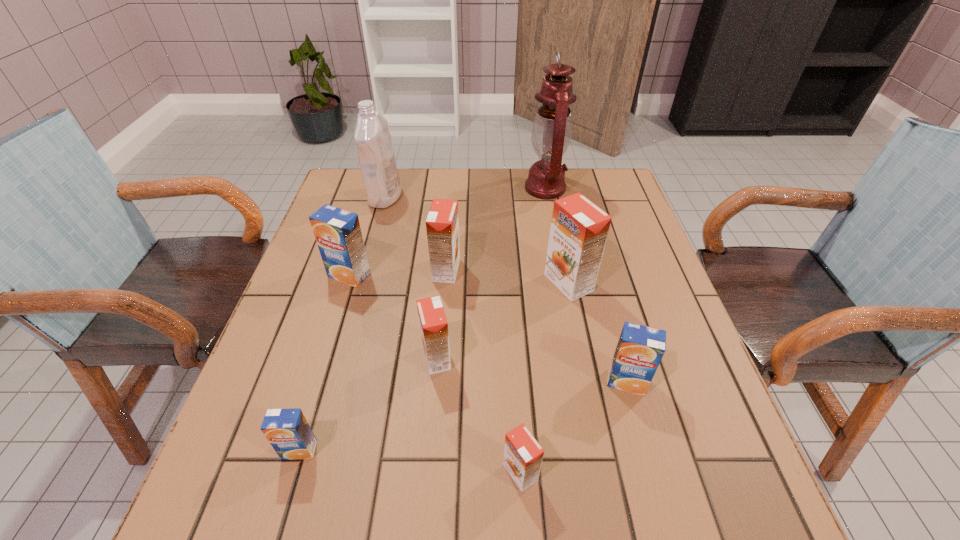
Image resolution: width=960 pixels, height=540 pixels. In order to click on free space located 0.280m on the left of the rightmost blue orange_juice in this screenshot , I will do `click(463, 382)`.

Identify the location of vacant area located 0.070m on the back of the smallest blue orange_juice. (313, 404).

Locate an element on the screen. The width and height of the screenshot is (960, 540). blank space located on the right of the second orange orange juice from right to left is located at coordinates (567, 472).

Find the location of `oil lamp that is at the far edge`. oil lamp that is at the far edge is located at coordinates (552, 128).

Locate an element on the screen. The image size is (960, 540). detergent at the far edge is located at coordinates (375, 151).

You are a GUI agent. You are given a task and a screenshot of the screen. Output one action in this format:
    pyautogui.click(x=<x>, y=<y>)
    Task: Click on the object located at the near edge
    The image size is (960, 540).
    Given the screenshot: What is the action you would take?
    pyautogui.click(x=523, y=455)

At what (x,y) coordinates should I click in order to perform the action: click on detergent at the left edge. Please return your answer as a coordinate pair (x, y). Image resolution: width=960 pixels, height=540 pixels. Looking at the image, I should click on (375, 151).

Locate an element on the screen. This screenshot has height=540, width=960. object at the right edge is located at coordinates (640, 348).

Identify the location of object that is at the far left corner. Image resolution: width=960 pixels, height=540 pixels. (375, 151).

Where is `vacant space at the far edge of the desktop`? This screenshot has height=540, width=960. vacant space at the far edge of the desktop is located at coordinates (465, 198).